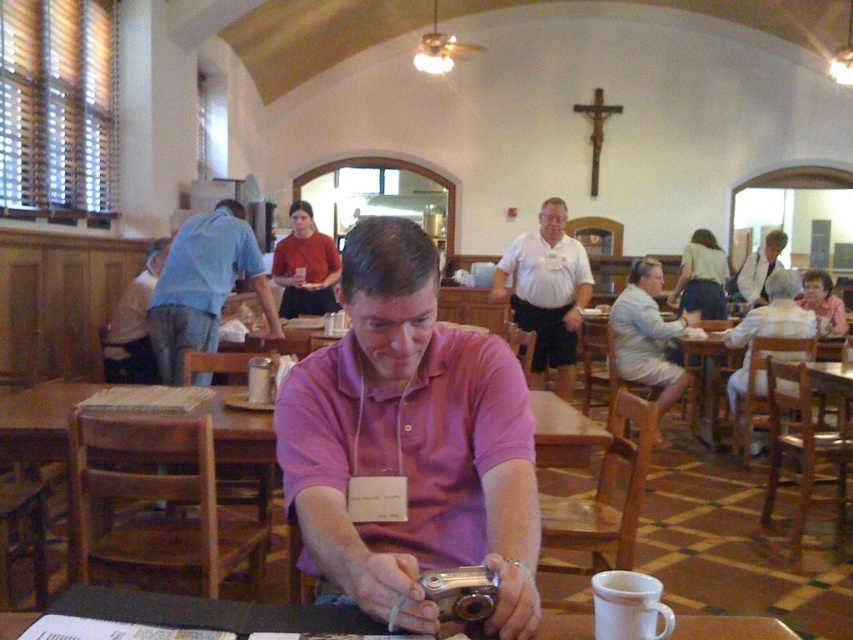
Does point (218, 228) come behind point (572, 321)?

That is False.

Which is behind, point (265, 316) or point (532, 241)?

The point (532, 241) is more distant.

At what (x,y) coordinates should I click in order to perform the action: click on blue jeans at left. Please return your answer as a coordinate pair (x, y). Looking at the image, I should click on (202, 285).

How much distance is there between white shirt at center and light blue shorts at right?

white shirt at center is 20.37 inches away from light blue shorts at right.

This screenshot has height=640, width=853. I want to click on white shirt at center, so click(x=547, y=292).

Is point (532, 353) positioned in front of point (688, 316)?

Yes, it is in front of point (688, 316).

This screenshot has height=640, width=853. Identify the location of white shirt at center. (547, 292).

This screenshot has width=853, height=640. In order to click on white shirt at center in this screenshot , I will do 547,292.

Image resolution: width=853 pixels, height=640 pixels. What are the coordinates of `white shirt at center` in the screenshot? It's located at (547, 292).